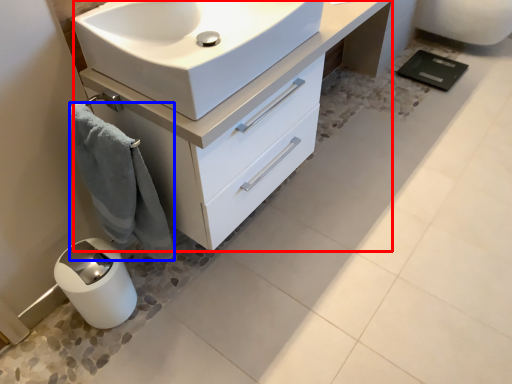
Question: Which point is closer to the camera, bathroom cabinet (highlighted by a red box) or bath towel (highlighted by a blue box)?

Choices:
 (A) bathroom cabinet
 (B) bath towel

Answer: (B)